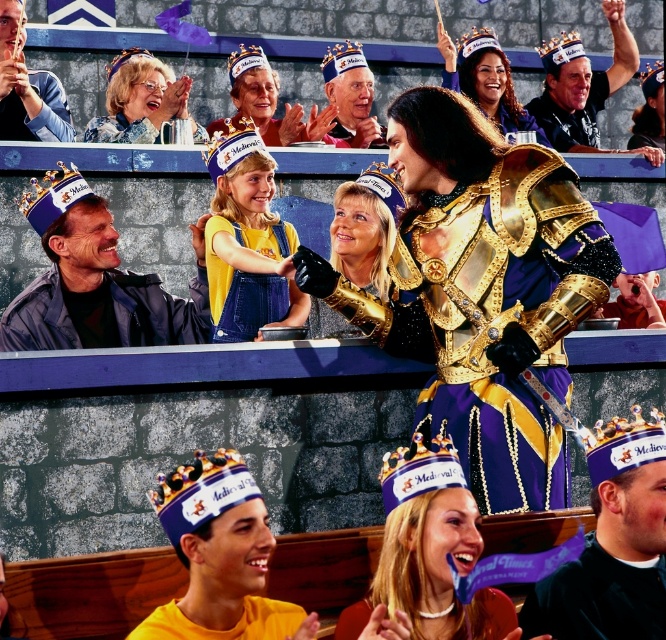
Does purple velvet crown at center have a greater width compared to matte blue crown at upper left?

No.

Is purple velvet crown at center bigger than matte blue crown at upper left?

Incorrect, purple velvet crown at center is not larger than matte blue crown at upper left.

Does point (426, 598) come behind point (180, 116)?

No, (426, 598) is in front of (180, 116).

Identify the location of purple velvet crown at center. (426, 554).

Which is in front, point (248, 168) or point (472, 33)?

Point (248, 168) is more forward.

What do you see at coordinates (246, 241) in the screenshot?
I see `yellow denim overalls at center` at bounding box center [246, 241].

The height and width of the screenshot is (640, 666). In order to click on yellow denim overalls at center in this screenshot , I will do click(246, 241).

How far apart are purple velvet crown at center and purple fabric crown at upper center?

purple velvet crown at center is 23.65 meters away from purple fabric crown at upper center.

Who is positioned more to the right, purple velvet crown at center or purple fabric crown at upper center?

purple fabric crown at upper center is more to the right.

Is point (372, 625) positioned before point (474, 33)?

Yes, point (372, 625) is in front of point (474, 33).

At what (x,y) coordinates should I click in order to perform the action: click on purple velvet crown at center. Please return your answer as a coordinate pair (x, y). This screenshot has width=666, height=640. Looking at the image, I should click on (426, 554).